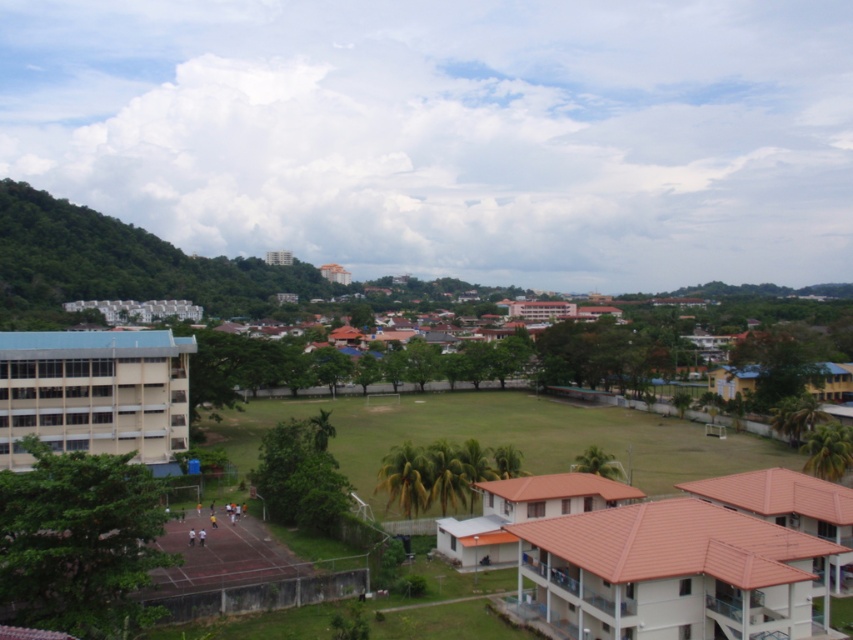
Question: Which point is closer to the camera taking this photo?

Choices:
 (A) (489, 554)
 (B) (140, 369)
 (C) (685, 624)
 (D) (723, 388)

Answer: (C)

Question: Which is nearer to the brown tile roof house at center?

Choices:
 (A) blue glass building at left
 (B) white tile building at lower right
 (C) yellow matte building at right

Answer: (B)

Question: Does white tile building at lower right have a larger size compared to yellow matte building at right?

Choices:
 (A) yes
 (B) no

Answer: (B)

Question: Is white tile building at lower right positioned behind blue glass building at left?

Choices:
 (A) yes
 (B) no

Answer: (B)

Question: Observing the image, what is the correct spatial positioning of blue glass building at left in reference to yellow matte building at right?

Choices:
 (A) above
 (B) below

Answer: (A)

Question: Which point is farther to the camera?

Choices:
 (A) (721, 372)
 (B) (612, 488)
 (C) (74, 400)

Answer: (A)